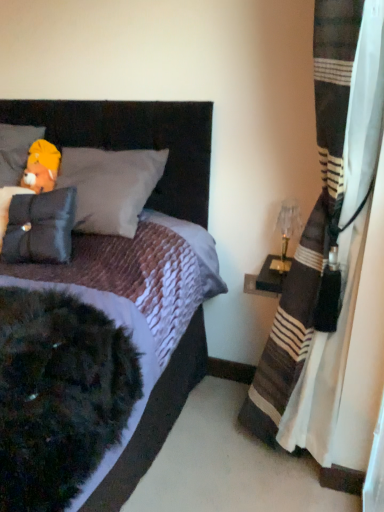
What are the coordinates of `vacant region below striped fabric curtain at right (from a real-world perspective)` in the screenshot? It's located at (270, 474).